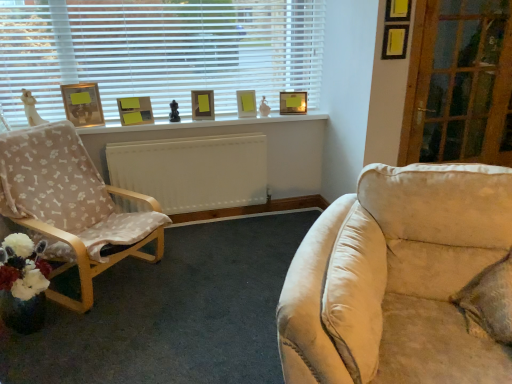
The image size is (512, 384). What do you see at coordinates (246, 103) in the screenshot? I see `matte yellow picture frame at upper center, which is the second picture frame in right-to-left order` at bounding box center [246, 103].

From the picture: Measure the distance between matte wooden picture frame at center, the 4th picture frame positioned from the right, and camera.

The distance of matte wooden picture frame at center, the 4th picture frame positioned from the right, from camera is 3.12 meters.

Where is `matte wooden picture frame at center, the 4th picture frame positioned from the right`? The height and width of the screenshot is (384, 512). matte wooden picture frame at center, the 4th picture frame positioned from the right is located at coordinates (135, 110).

The width and height of the screenshot is (512, 384). Describe the element at coordinates (460, 84) in the screenshot. I see `transparent wooden door at right` at that location.

Where is `gold metallic picture frame at upper left, the fifth picture frame from the right`? This screenshot has width=512, height=384. gold metallic picture frame at upper left, the fifth picture frame from the right is located at coordinates point(83,104).

Would you consider matte wooden picture frame at upper center, positioned as the 1th picture frame in right-to-left order, to be distant from gold metallic picture frame at upper left, placed as the 1th picture frame when sorted from left to right?

Yes, matte wooden picture frame at upper center, positioned as the 1th picture frame in right-to-left order, and gold metallic picture frame at upper left, placed as the 1th picture frame when sorted from left to right, are quite far apart.

Measure the distance between matte wooden picture frame at upper center, the 5th picture frame positioned from the left, and gold metallic picture frame at upper left, the fifth picture frame from the right.

matte wooden picture frame at upper center, the 5th picture frame positioned from the left, is 4.90 feet from gold metallic picture frame at upper left, the fifth picture frame from the right.

Consider the image. Who is taller, matte wooden picture frame at upper center, the 5th picture frame positioned from the left, or gold metallic picture frame at upper left, placed as the 1th picture frame when sorted from left to right?

Standing taller between the two is gold metallic picture frame at upper left, placed as the 1th picture frame when sorted from left to right.

Does matte wooden picture frame at upper center, positioned as the 1th picture frame in right-to-left order, have a larger size compared to gold metallic picture frame at upper left, placed as the 1th picture frame when sorted from left to right?

No, matte wooden picture frame at upper center, positioned as the 1th picture frame in right-to-left order, is not bigger than gold metallic picture frame at upper left, placed as the 1th picture frame when sorted from left to right.

Can you confirm if beige fabric chair at left is wider than white painted wood at upper center?

Yes.

Would you say beige fabric chair at left is to the left or to the right of white painted wood at upper center in the picture?

beige fabric chair at left is positioned on white painted wood at upper center's left side.

Is beige fabric chair at left aimed at white painted wood at upper center?

No, beige fabric chair at left is not turned towards white painted wood at upper center.

From a real-world perspective, is beige fabric chair at left physically located above or below white painted wood at upper center?

In terms of real-world spatial position, beige fabric chair at left is below white painted wood at upper center.

Which is nearer, (292,92) or (26,190)?

The point (26,190) is closer.

From a real-world perspective, is matte wooden picture frame at upper center, positioned as the 1th picture frame in right-to-left order, below beige fabric chair at left?

No, from a real-world perspective, matte wooden picture frame at upper center, positioned as the 1th picture frame in right-to-left order, is not below beige fabric chair at left.

In the scene shown: Is matte wooden picture frame at upper center, positioned as the 1th picture frame in right-to-left order, looking in the opposite direction of beige fabric chair at left?

No, beige fabric chair at left is not at the back of matte wooden picture frame at upper center, positioned as the 1th picture frame in right-to-left order.

Are matte wooden picture frame at upper center, positioned as the 1th picture frame in right-to-left order, and beige fabric chair at left located far from each other?

Yes.

What's the angular difference between matte wooden picture frame at upper center, positioned as the 1th picture frame in right-to-left order, and transparent wooden door at right's facing directions?

The facing directions of matte wooden picture frame at upper center, positioned as the 1th picture frame in right-to-left order, and transparent wooden door at right are 9.14 degrees apart.

From a real-world perspective, is matte wooden picture frame at upper center, the 5th picture frame positioned from the left, beneath transparent wooden door at right?

Correct, in the physical world, matte wooden picture frame at upper center, the 5th picture frame positioned from the left, is lower than transparent wooden door at right.

Is matte wooden picture frame at upper center, the 5th picture frame positioned from the left, facing away from transparent wooden door at right?

That's not correct — matte wooden picture frame at upper center, the 5th picture frame positioned from the left, is not looking away from transparent wooden door at right.

Does point (289, 113) come closer to viewer compared to point (212, 97)?

No, (289, 113) is behind (212, 97).

From the picture: Does matte wooden picture frame at upper center, the 5th picture frame positioned from the left, have a smaller size compared to matte gold picture frame at upper center, marked as the third picture frame in a left-to-right arrangement?

Indeed, matte wooden picture frame at upper center, the 5th picture frame positioned from the left, has a smaller size compared to matte gold picture frame at upper center, marked as the third picture frame in a left-to-right arrangement.

Is matte wooden picture frame at upper center, the 5th picture frame positioned from the left, taller than matte gold picture frame at upper center, the 3th picture frame when ordered from right to left?

No, matte wooden picture frame at upper center, the 5th picture frame positioned from the left, is not taller than matte gold picture frame at upper center, the 3th picture frame when ordered from right to left.

From the image's perspective, who appears lower, gold metallic picture frame at upper left, placed as the 1th picture frame when sorted from left to right, or matte gold picture frame at upper center, the 3th picture frame when ordered from right to left?

From the image's view, gold metallic picture frame at upper left, placed as the 1th picture frame when sorted from left to right, is below.

In the scene shown: Is gold metallic picture frame at upper left, placed as the 1th picture frame when sorted from left to right, next to matte gold picture frame at upper center, marked as the third picture frame in a left-to-right arrangement, and touching it?

No, gold metallic picture frame at upper left, placed as the 1th picture frame when sorted from left to right, is not with matte gold picture frame at upper center, marked as the third picture frame in a left-to-right arrangement.

Consider the image. Is gold metallic picture frame at upper left, the fifth picture frame from the right, bigger than matte gold picture frame at upper center, the 3th picture frame when ordered from right to left?

Correct, gold metallic picture frame at upper left, the fifth picture frame from the right, is larger in size than matte gold picture frame at upper center, the 3th picture frame when ordered from right to left.

How much distance is there between white plastic blinds at upper left and matte wooden picture frame at center, which ranks as the 2th picture frame in left-to-right order?

white plastic blinds at upper left is 57.37 centimeters from matte wooden picture frame at center, which ranks as the 2th picture frame in left-to-right order.

Is white plastic blinds at upper left shorter than matte wooden picture frame at center, the 4th picture frame positioned from the right?

No.

What's the angular difference between white plastic blinds at upper left and matte wooden picture frame at center, the 4th picture frame positioned from the right,'s facing directions?

They differ by 3.34 degrees in their facing directions.

Looking at this image, is white plastic blinds at upper left closer to camera compared to matte wooden picture frame at center, the 4th picture frame positioned from the right?

Yes, white plastic blinds at upper left is closer to the viewer.

You are a GUI agent. You are given a task and a screenshot of the screen. Output one action in this format:
    pyautogui.click(x=<x>, y=<y>)
    Task: Click on the 4th picture frame counting from the left side of the matte wooden picture frame at upper center, the 5th picture frame positioned from the left
    This screenshot has height=384, width=512.
    Given the screenshot: What is the action you would take?
    pyautogui.click(x=83, y=104)

What are the coordinates of `window sill positioned vertically above the beige fabric chair at left (from a real-world perspective)` in the screenshot? It's located at (201, 123).

When comparing their distances from matte wooden picture frame at center, the 4th picture frame positioned from the right, does white painted wood at upper center or gold metallic picture frame at upper left, placed as the 1th picture frame when sorted from left to right, seem further?

Based on the image, white painted wood at upper center appears to be further to matte wooden picture frame at center, the 4th picture frame positioned from the right.

Based on their spatial positions, is matte gold picture frame at upper center, the 3th picture frame when ordered from right to left, or matte yellow picture frame at upper center, which is the second picture frame in right-to-left order, further from matte wooden picture frame at center, which ranks as the 2th picture frame in left-to-right order?

matte yellow picture frame at upper center, which is the second picture frame in right-to-left order, is positioned further to the anchor matte wooden picture frame at center, which ranks as the 2th picture frame in left-to-right order.

From the image, which object appears to be farther from beige fabric chair at left, matte gold picture frame at upper center, the 3th picture frame when ordered from right to left, or matte wooden picture frame at upper center, positioned as the 1th picture frame in right-to-left order?

matte wooden picture frame at upper center, positioned as the 1th picture frame in right-to-left order, is positioned further to the anchor beige fabric chair at left.

Based on their spatial positions, is beige fabric chair at left or white plastic blinds at upper left closer to gold metallic picture frame at upper left, placed as the 1th picture frame when sorted from left to right?

white plastic blinds at upper left is positioned closer to the anchor gold metallic picture frame at upper left, placed as the 1th picture frame when sorted from left to right.

From the image, which object appears to be nearer to matte wooden picture frame at upper center, the 5th picture frame positioned from the left, matte gold picture frame at upper center, marked as the third picture frame in a left-to-right arrangement, or matte yellow picture frame at upper center, the fourth picture frame positioned from the left?

matte yellow picture frame at upper center, the fourth picture frame positioned from the left, is closer to matte wooden picture frame at upper center, the 5th picture frame positioned from the left.

Based on their spatial positions, is gold metallic picture frame at upper left, the fifth picture frame from the right, or matte wooden picture frame at upper center, positioned as the 1th picture frame in right-to-left order, closer to white painted wood at upper center?

The object closer to white painted wood at upper center is gold metallic picture frame at upper left, the fifth picture frame from the right.

When comparing their distances from transparent wooden door at right, does matte yellow picture frame at upper center, which is the second picture frame in right-to-left order, or matte gold picture frame at upper center, the 3th picture frame when ordered from right to left, seem closer?

matte yellow picture frame at upper center, which is the second picture frame in right-to-left order.

Looking at the image, which one is located closer to gold metallic picture frame at upper left, the fifth picture frame from the right, matte wooden picture frame at upper center, the 5th picture frame positioned from the left, or beige fabric chair at left?

The object closer to gold metallic picture frame at upper left, the fifth picture frame from the right, is beige fabric chair at left.

Locate an element on the screen. This screenshot has width=512, height=384. picture frame situated between matte wooden picture frame at center, the 4th picture frame positioned from the right, and matte yellow picture frame at upper center, which is the second picture frame in right-to-left order, from left to right is located at coordinates (202, 105).

Locate an element on the screen. window sill between white plastic blinds at upper left and beige fabric chair at left in the vertical direction is located at coordinates (201, 123).

Find the location of a particular element. This screenshot has height=384, width=512. window sill situated between beige fabric chair at left and transparent wooden door at right from left to right is located at coordinates (201, 123).

You are a GUI agent. You are given a task and a screenshot of the screen. Output one action in this format:
    pyautogui.click(x=<x>, y=<y>)
    Task: Click on the picture frame located between matte gold picture frame at upper center, the 3th picture frame when ordered from right to left, and matte wooden picture frame at upper center, positioned as the 1th picture frame in right-to-left order, in the left-right direction
    This screenshot has width=512, height=384.
    Given the screenshot: What is the action you would take?
    pyautogui.click(x=246, y=103)